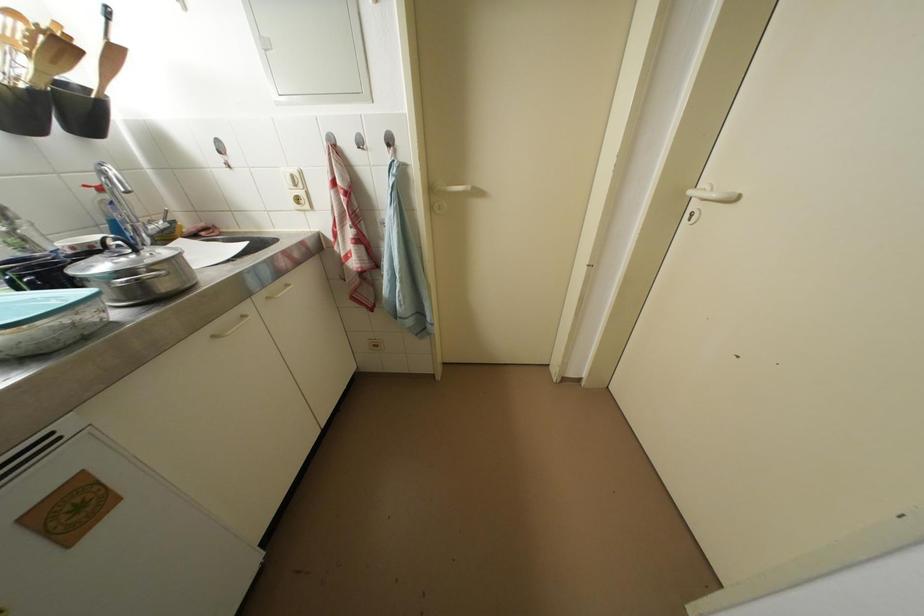
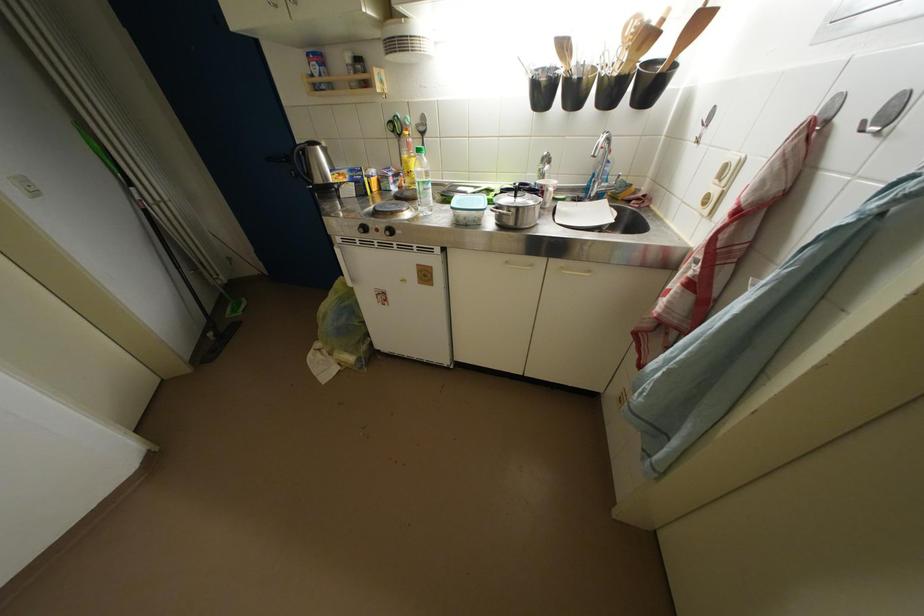
In the second image, find the point that corresponds to point (32, 67) in the first image.

(631, 60)